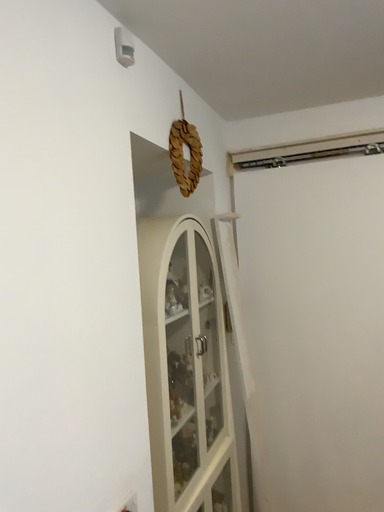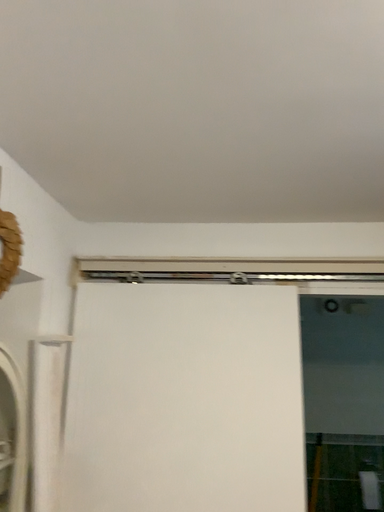
Question: Which way did the camera rotate in the video?

Choices:
 (A) rotated downward
 (B) rotated upward

Answer: (B)